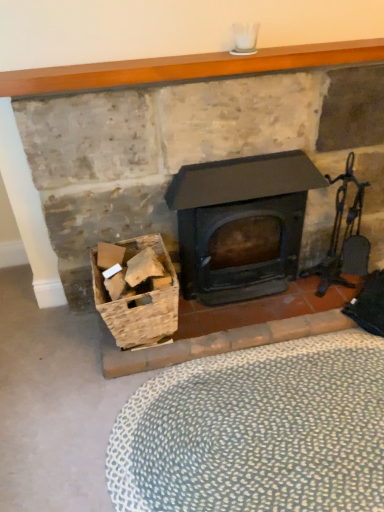
What are the coordinates of `free location above white dotted rug at lower center (from a real-world perspective)` in the screenshot? It's located at (264, 423).